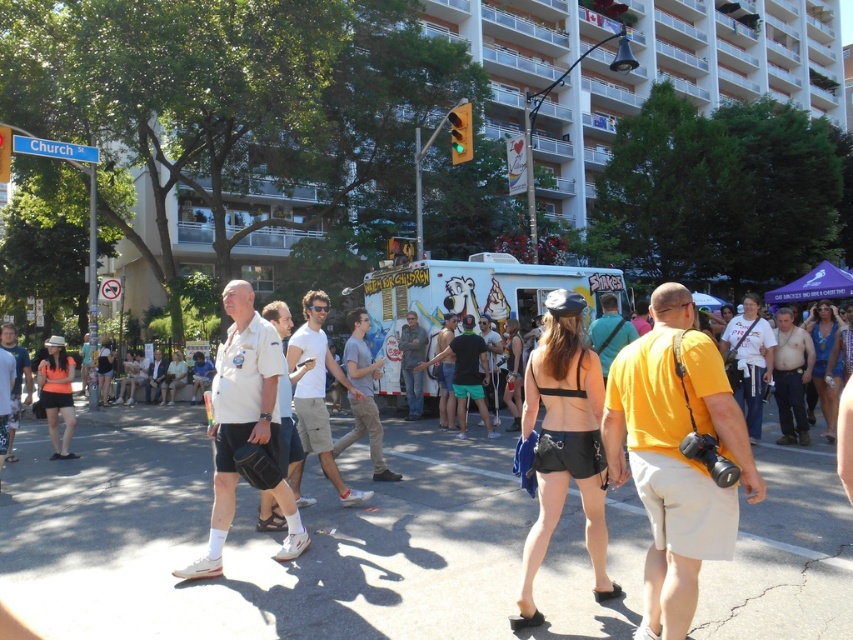
You are standing on the sidewalk and see the light brown cotton shirt at center and the matte black shorts at left. Which item is positioned higher relative to the other?

The light brown cotton shirt at center is located above the matte black shorts at left, so it is positioned higher.

You are a fashion designer observing the crowd and notice two pairs of shorts at the center of the scene. Which pair of shorts is taller between the black leather shorts at center and the white matte shorts at center?

The black leather shorts at center is taller than the white matte shorts at center.

You are standing at the light brown cotton shirt at center. You want to walk to the food truck. How many people are between you and the food truck?

The question cannot be answered with the provided information.